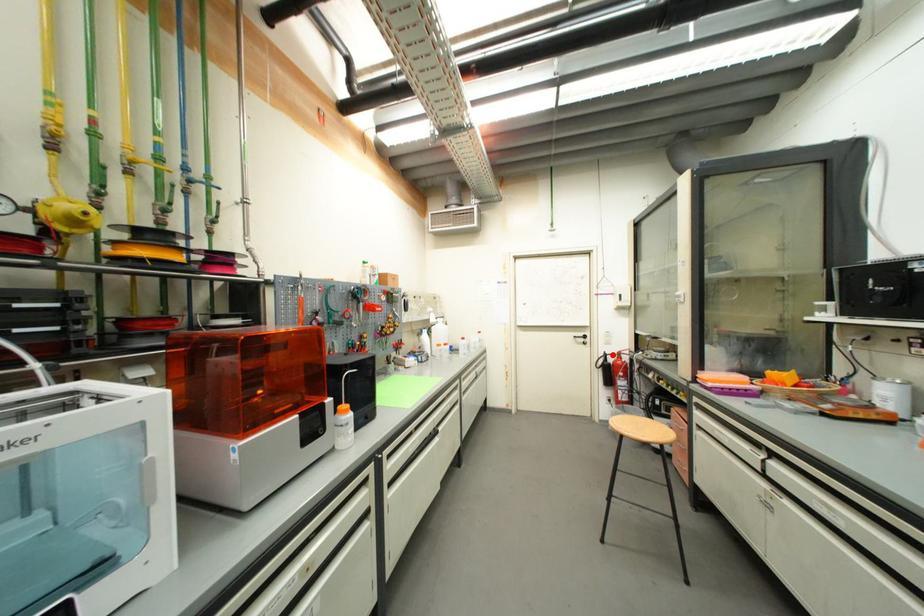
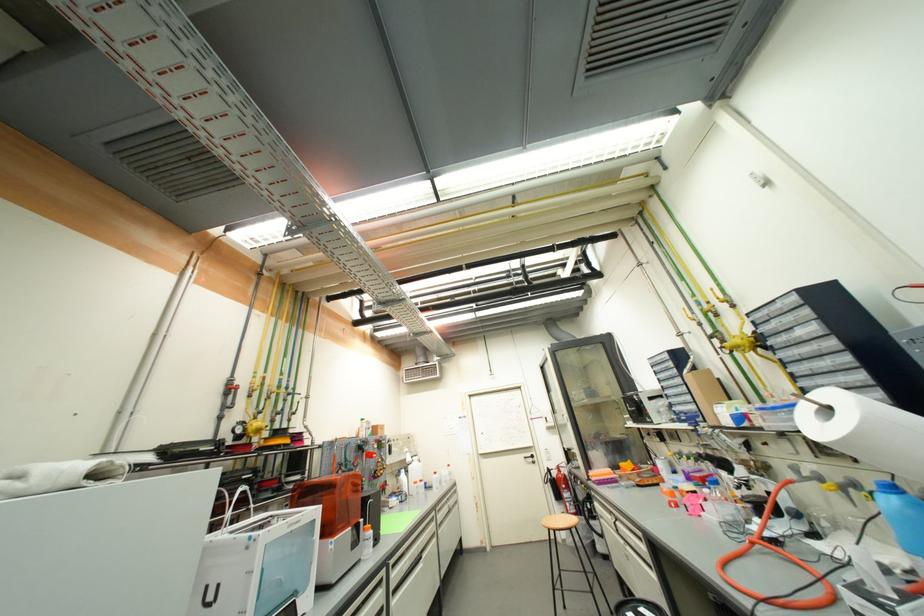
Locate, in the second image, the point that corresponds to the highlighted location in the first image.

(554, 469)